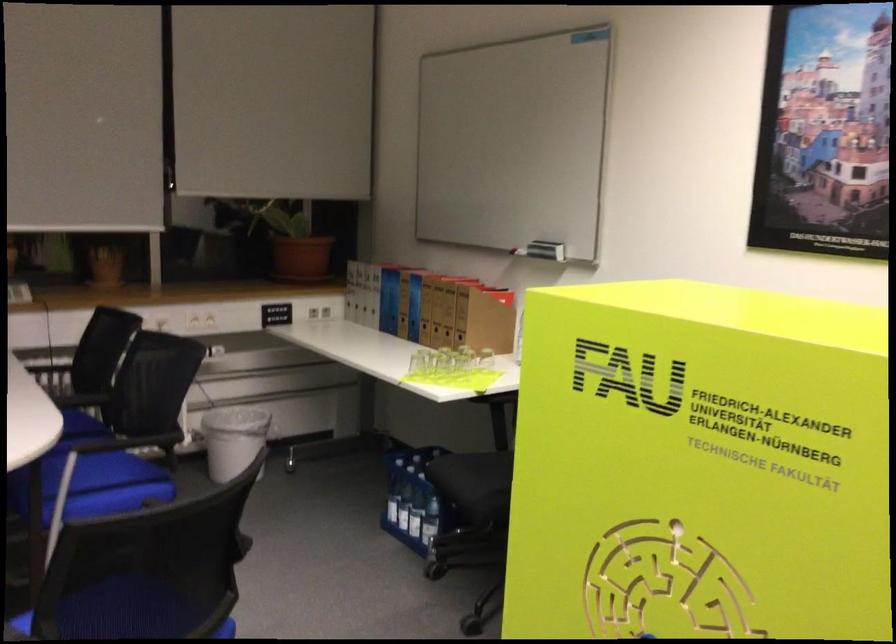
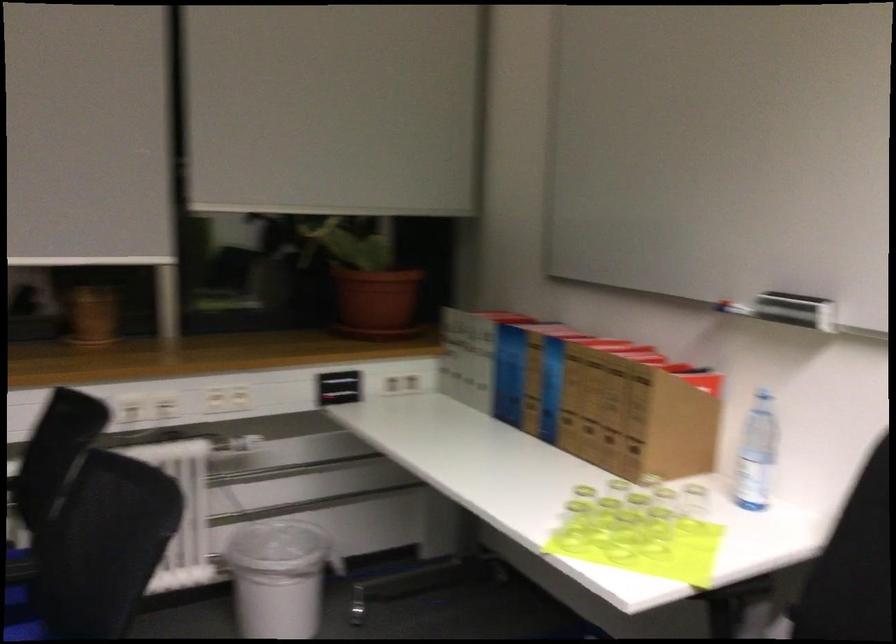
In the second image, find the point that corresponds to the point at 88,433 in the first image.

(23, 603)